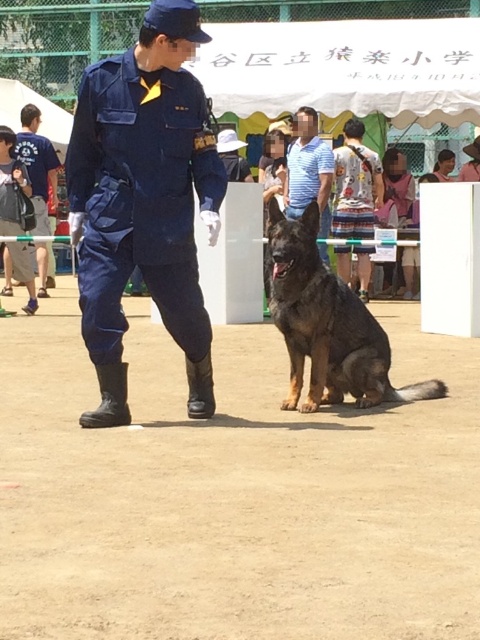
You are a photographer trying to capture a wide shot of the dirt field at center and the striped cotton shirt at center. Given their sizes, which object should you focus on to ensure both are fully visible in the frame?

The dirt field at center has a smaller width compared to the striped cotton shirt at center. To ensure both are fully visible, focus on the striped cotton shirt at center as it is wider and will require more space in the frame.

You are standing at the origin point in the image. Where is the dirt field at center located in terms of coordinates?

The dirt field at center is located at coordinates point (233,493).